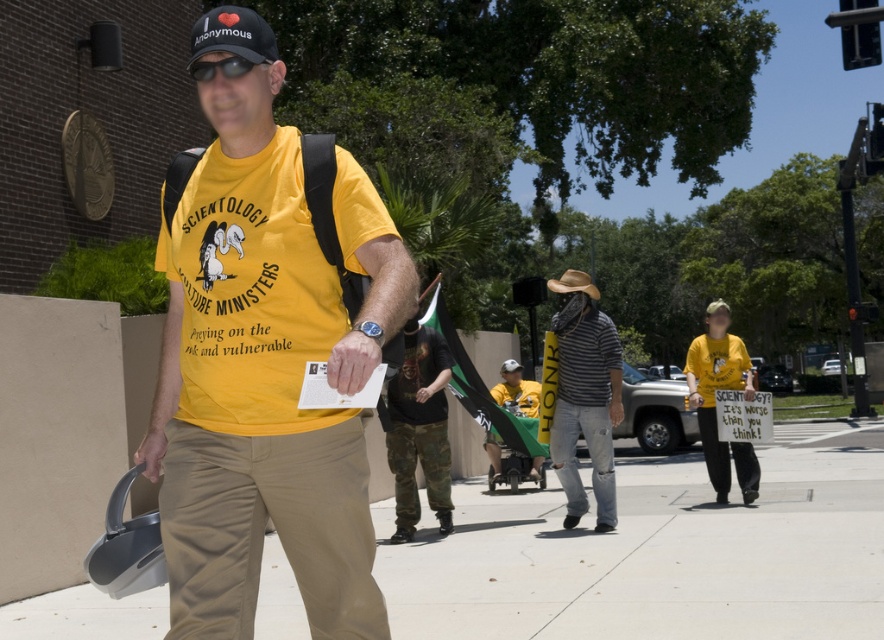
Can you confirm if striped cotton shirt at center is positioned below camo pants at center?

Incorrect, striped cotton shirt at center is not positioned below camo pants at center.

Does striped cotton shirt at center have a greater width compared to camo pants at center?

In fact, striped cotton shirt at center might be narrower than camo pants at center.

Locate an element on the screen. The image size is (884, 640). striped cotton shirt at center is located at coordinates (x=585, y=397).

You are a GUI agent. You are given a task and a screenshot of the screen. Output one action in this format:
    pyautogui.click(x=<x>, y=<y>)
    Task: Click on the striped cotton shirt at center
    The image size is (884, 640).
    Given the screenshot: What is the action you would take?
    pyautogui.click(x=585, y=397)

Does yellow matte t-shirt at center have a lesser height compared to yellow t-shirt at center?

Yes, yellow matte t-shirt at center is shorter than yellow t-shirt at center.

Looking at this image, which is above, yellow matte t-shirt at center or yellow t-shirt at center?

yellow matte t-shirt at center is higher up.

Between point (372, 637) and point (724, 490), which one is positioned behind?

The point (724, 490) is more distant.

The height and width of the screenshot is (640, 884). Find the location of `yellow matte t-shirt at center`. yellow matte t-shirt at center is located at coordinates (265, 360).

This screenshot has width=884, height=640. What do you see at coordinates (658, 552) in the screenshot? I see `smooth concrete sidewalk at center` at bounding box center [658, 552].

Which is behind, point (834, 496) or point (599, 392)?

The point (834, 496) is more distant.

Locate an element on the screen. This screenshot has height=640, width=884. smooth concrete sidewalk at center is located at coordinates (658, 552).

What are the coordinates of `smooth concrete sidewalk at center` in the screenshot? It's located at (658, 552).